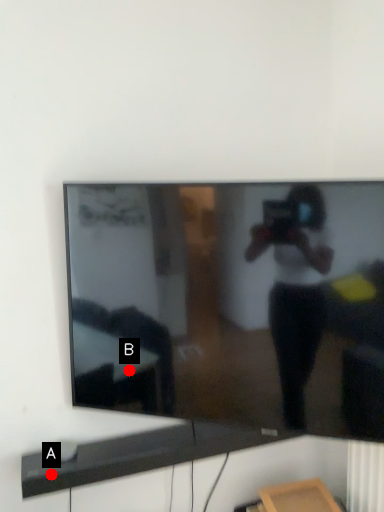
Question: Two points are circled on the image, labeled by A and B beside each circle. Among these points, which one is farthest from the camera?

Choices:
 (A) A is further
 (B) B is further

Answer: (B)